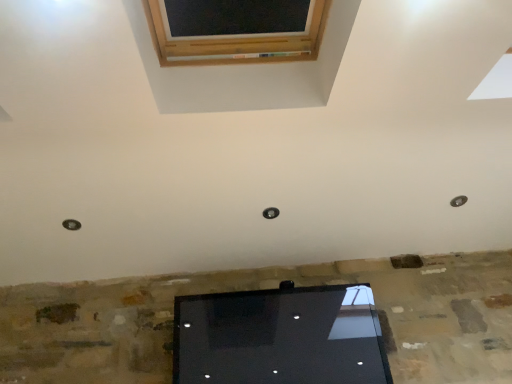
Question: From the image's perspective, is metallic circular hole at lower left, marked as the 2th hole in a right-to-left arrangement, located above or below metallic circular hole at right, the 2th hole positioned from the left?

Choices:
 (A) above
 (B) below

Answer: (B)

Question: From a real-world perspective, is metallic circular hole at lower left, the second hole viewed from the top, above or below metallic circular hole at right, the second hole ordered from the bottom?

Choices:
 (A) below
 (B) above

Answer: (B)

Question: Is metallic circular hole at lower left, placed as the 1th hole when sorted from left to right, to the left or to the right of metallic circular hole at right, the second hole ordered from the bottom, in the image?

Choices:
 (A) left
 (B) right

Answer: (A)

Question: Considering the relative positions of metallic circular hole at right, which is the 1th hole from right to left, and metallic circular hole at lower left, which appears as the second hole when viewed from the back, in the image provided, is metallic circular hole at right, which is the 1th hole from right to left, to the left or to the right of metallic circular hole at lower left, which appears as the second hole when viewed from the back,?

Choices:
 (A) right
 (B) left

Answer: (A)

Question: In the image, is metallic circular hole at right, the 2th hole positioned from the left, positioned in front of or behind metallic circular hole at lower left, placed as the 1th hole when sorted from left to right?

Choices:
 (A) front
 (B) behind

Answer: (B)

Question: Looking at the image, does metallic circular hole at right, the 2th hole in the front-to-back sequence, seem bigger or smaller compared to metallic circular hole at lower left, the second hole viewed from the top?

Choices:
 (A) small
 (B) big

Answer: (A)

Question: In terms of height, does metallic circular hole at right, which is the 1th hole from right to left, look taller or shorter compared to metallic circular hole at lower left, positioned as the 1th hole in front-to-back order?

Choices:
 (A) short
 (B) tall

Answer: (A)